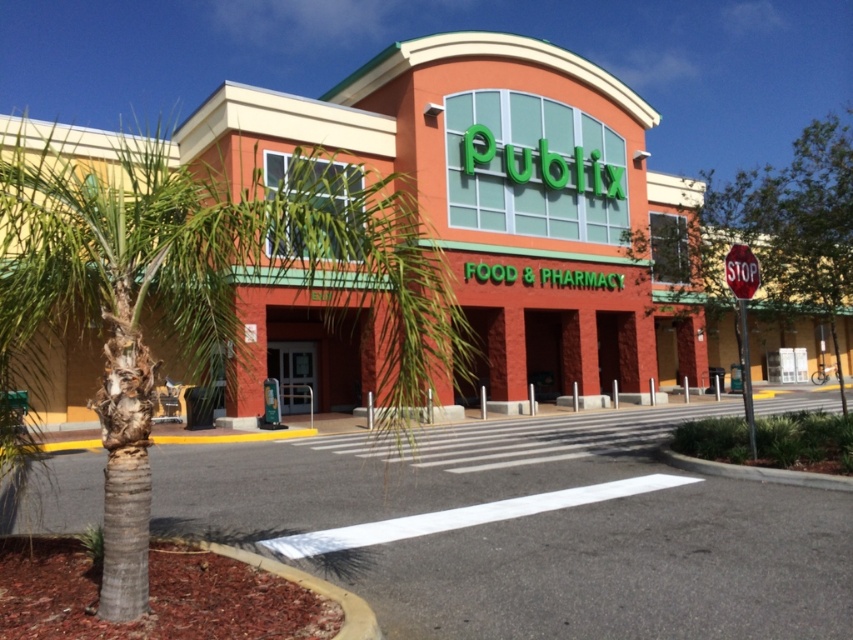
You are standing in front of the Publix supermarket entrance. The green leafy palm tree at center is located at point 0.466 on the x axis and 0.141 on the y axis. If you want to walk towards the palm tree, which direction should you move relative to your current position?

The green leafy palm tree at center is located at coordinates x 0.466 and y 0.141. Since the palm tree is at the center, you should move forward towards the middle of the Publix supermarket entrance area to reach it.

You are standing in front of the Publix supermarket and want to take a photo of both the matte brick building at center and the green leafy palm tree at center. Which object will appear larger in the photo?

The matte brick building at center will appear larger in the photo because it is much taller than the green leafy palm tree at center.